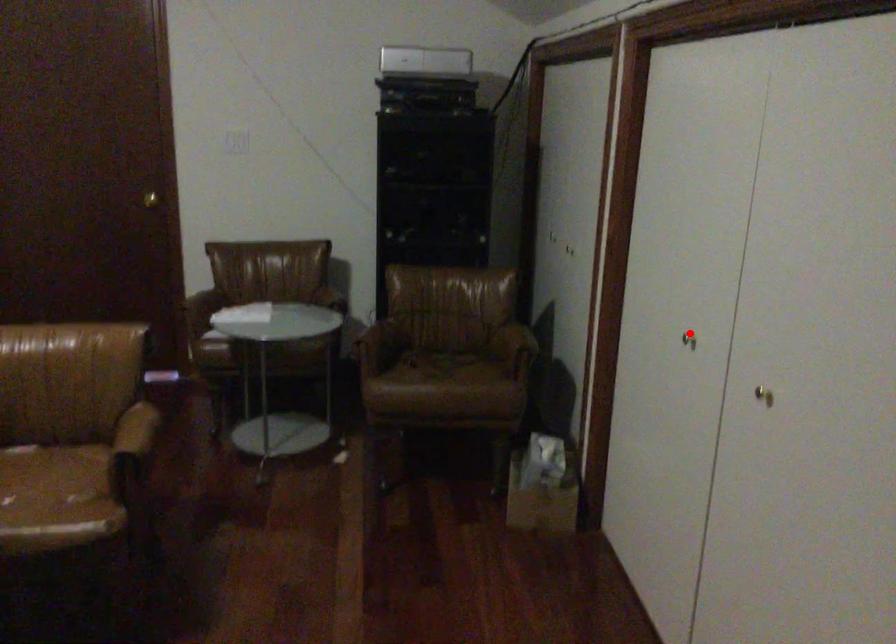
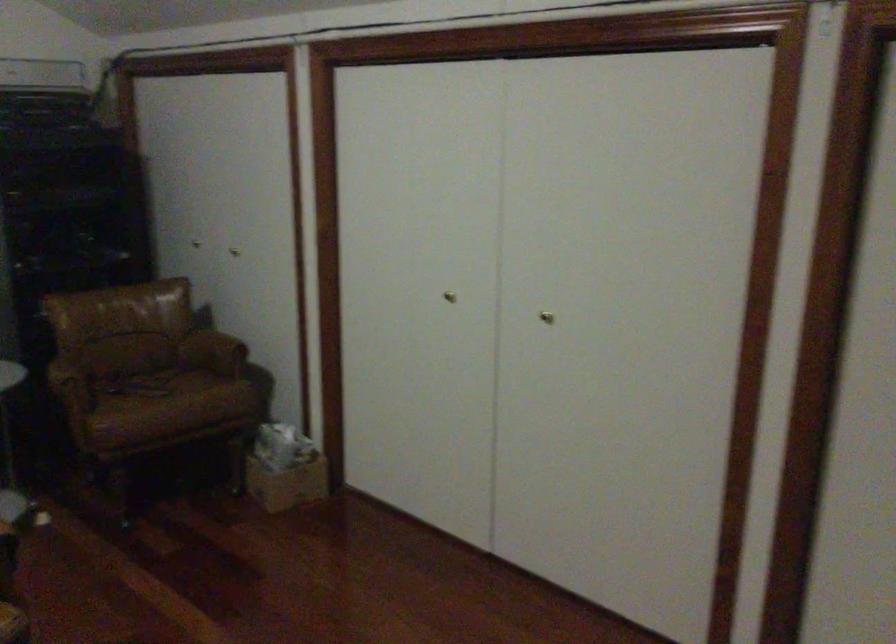
Question: I am providing you with two images of the same scene from different viewpoints. In image1, a red point is highlighted. Considering the same 3D point in image2, which of the following is correct?

Choices:
 (A) It is closer
 (B) It is farther

Answer: (B)